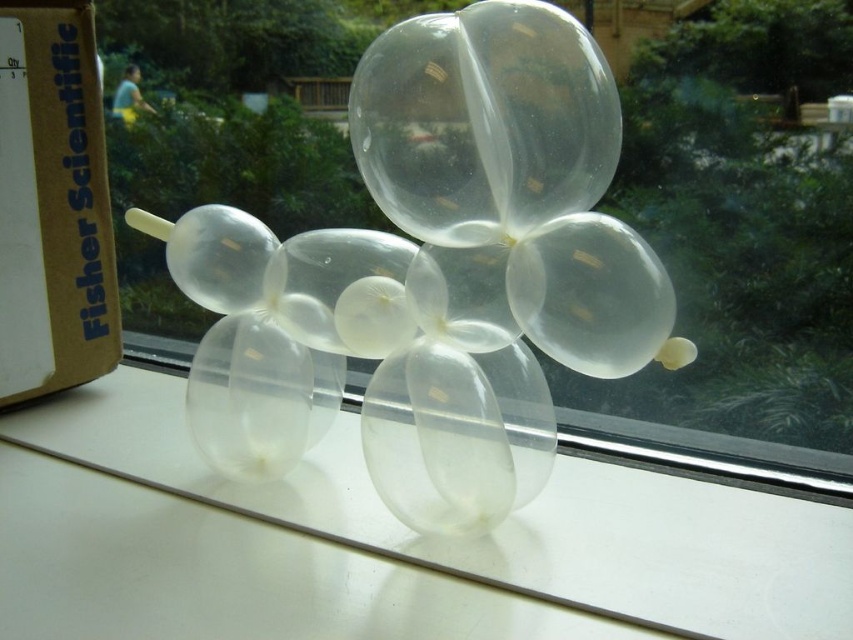
You are organizing a science fair booth and need to place the transparent plastic balloon at center and the transparent plastic table at center in a way that they are both visible to visitors. Given their sizes, which object should be placed closer to the front of the booth to ensure both are easily seen?

The transparent plastic balloon at center is smaller than the transparent plastic table at center. To ensure both are easily seen, the smaller transparent plastic balloon at center should be placed closer to the front of the booth so that it is more visible alongside the larger table.

You are a delivery person who needs to place a new 20 cm wide box on the transparent plastic table at center. The transparent plastic balloon at center is currently on the table. Can you place the box on the table without moving the balloon?

The transparent plastic balloon at center and transparent plastic table at center are 21.07 centimeters apart from each other. Since the balloon is not on the table, there is enough space to place the 20 cm wide box on the transparent plastic table at center without moving the balloon.

You are a visitor in this room and want to take a photo of the transparent plastic balloon at center and the transparent plastic table at center. Which object will appear larger in the photo?

The transparent plastic balloon at center will appear larger in the photo because it has a greater height compared to the transparent plastic table at center.